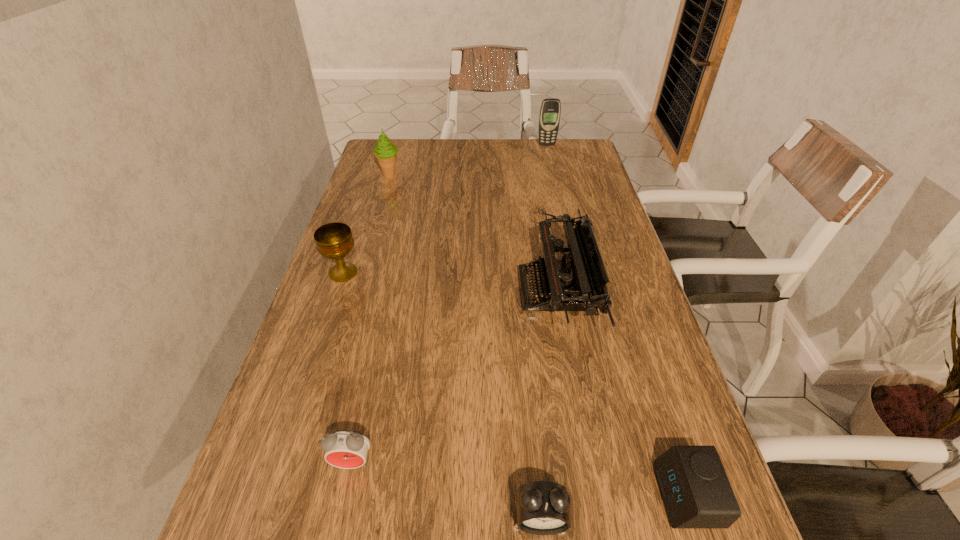
I want to click on vacant space at the right edge of the desktop, so click(x=612, y=268).

You are a GUI agent. You are given a task and a screenshot of the screen. Output one action in this format:
    pyautogui.click(x=<x>, y=<y>)
    Task: Click on the free point between the icecream and the second alarm clock from left to right
    
    Given the screenshot: What is the action you would take?
    pyautogui.click(x=465, y=347)

You are a GUI agent. You are given a task and a screenshot of the screen. Output one action in this format:
    pyautogui.click(x=<x>, y=<y>)
    Task: Click on the vacant space in between the shortest alarm clock and the farthest object
    The height and width of the screenshot is (540, 960).
    Given the screenshot: What is the action you would take?
    pyautogui.click(x=616, y=320)

Locate an element on the screen. vacant region between the second farthest object and the rightmost alarm clock is located at coordinates (538, 335).

Identify the location of free space between the sixth nearest object and the rightmost object. point(538,335).

In order to click on vacant space that is in between the farthest object and the typewriter in this screenshot , I will do coord(551,218).

The width and height of the screenshot is (960, 540). I want to click on empty location between the farthest object and the rightmost object, so click(x=616, y=320).

Locate an element on the screen. The width and height of the screenshot is (960, 540). vacant space that is in between the shortest alarm clock and the second alarm clock from right to left is located at coordinates (613, 507).

Image resolution: width=960 pixels, height=540 pixels. What are the coordinates of `unoccupied area between the farthest object and the icecream` in the screenshot? It's located at (468, 160).

Locate an element on the screen. vacant area between the farthest object and the icecream is located at coordinates (468, 160).